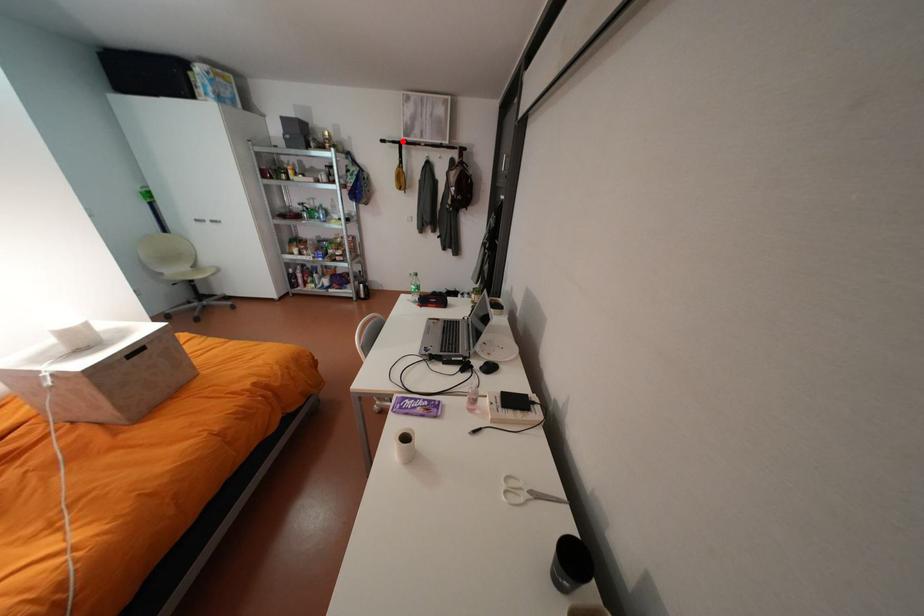
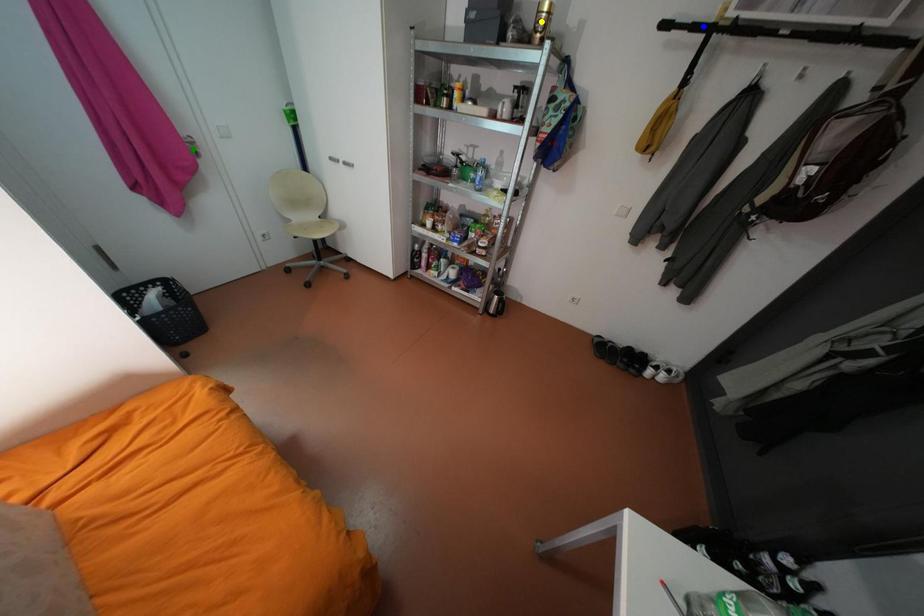
Question: I am providing you with two images of the same scene from different viewpoints. A red point is marked on the first image. You are given multiple points on the second image. Can you choose the point in image 2 that corresponds to the point in image 1?

Choices:
 (A) blue point
 (B) green point
 (C) yellow point

Answer: (A)